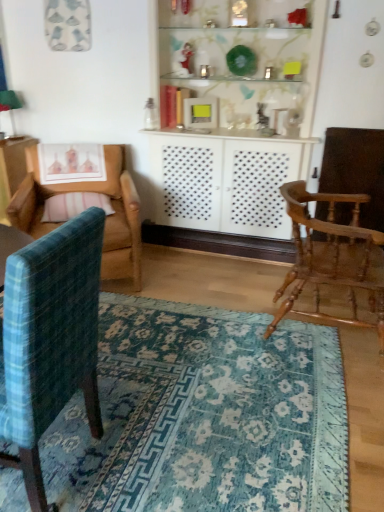
You are a GUI agent. You are given a task and a screenshot of the screen. Output one action in this format:
    pyautogui.click(x=<x>, y=<y>)
    Task: Click on the free spot above pink striped pillow at left (from a real-world perspective)
    
    Given the screenshot: What is the action you would take?
    pyautogui.click(x=73, y=198)